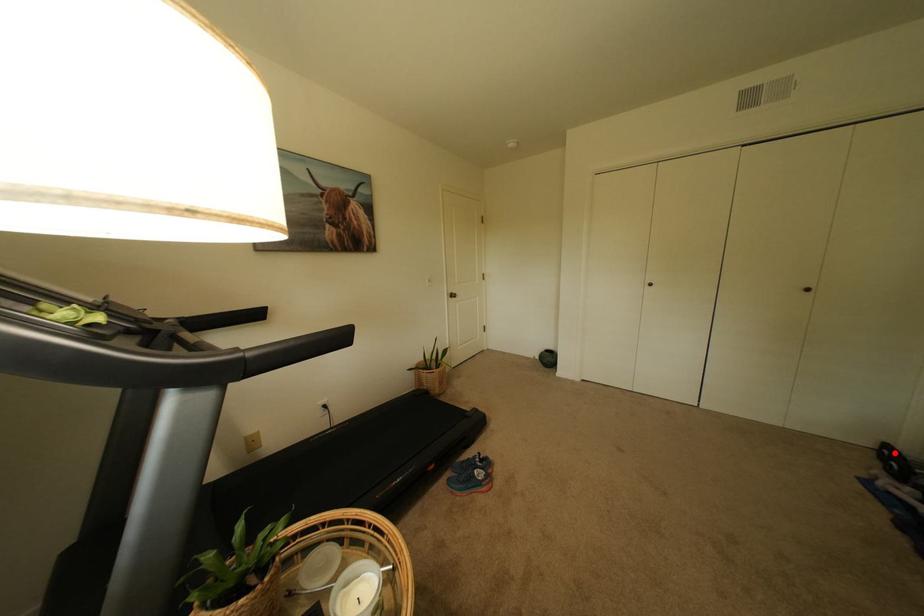
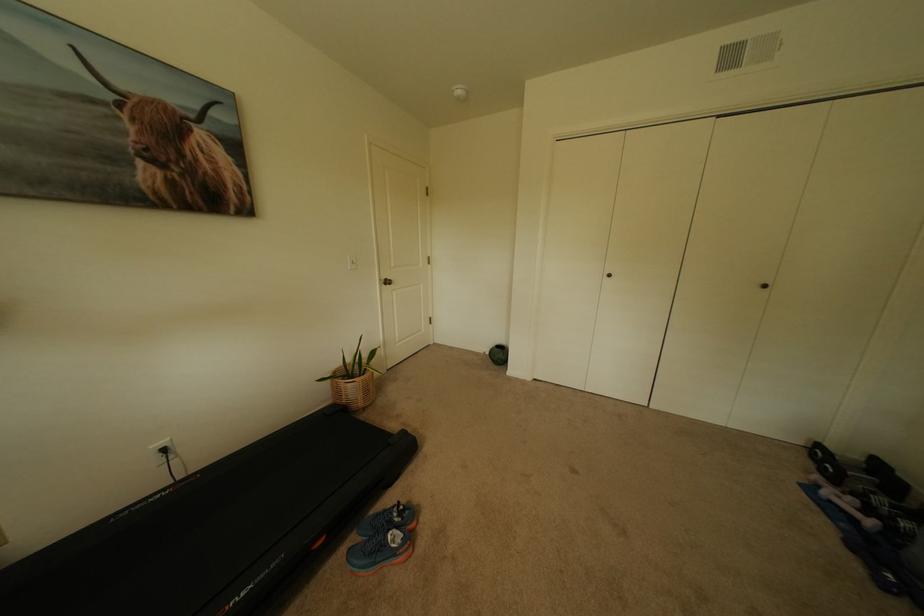
Question: I am providing you with two images of the same scene from different viewpoints. A red point is shown in image1. For the corresponding object point in image2, is it positioned nearer or farther from the camera?

Choices:
 (A) Nearer
 (B) Farther

Answer: (A)